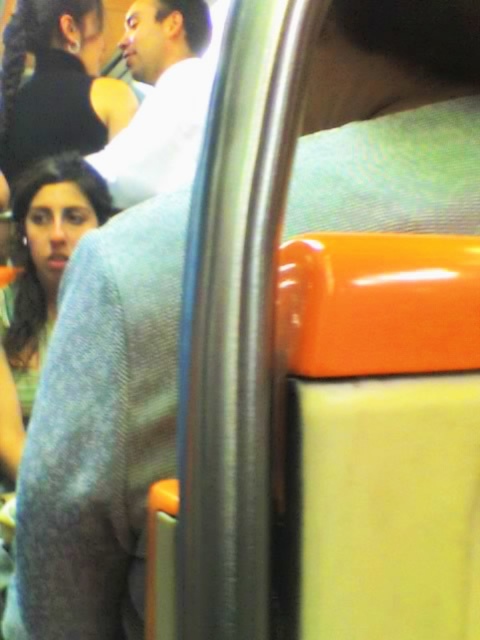
Can you confirm if matte black hair at upper left is taller than white cotton shirt at upper center?

No, matte black hair at upper left is not taller than white cotton shirt at upper center.

Looking at this image, does matte black hair at upper left have a greater width compared to white cotton shirt at upper center?

Indeed, matte black hair at upper left has a greater width compared to white cotton shirt at upper center.

Is point (54, 115) positioned after point (132, 144)?

Yes, point (54, 115) is behind point (132, 144).

Where is `matte black hair at upper left`? This screenshot has width=480, height=640. matte black hair at upper left is located at coordinates (57, 84).